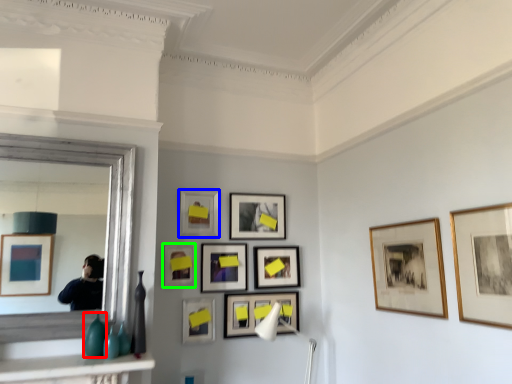
Question: Considering the real-world distances, which object is closest to glass vase (highlighted by a red box)? picture frame (highlighted by a blue box) or picture frame (highlighted by a green box).

Choices:
 (A) picture frame
 (B) picture frame

Answer: (B)